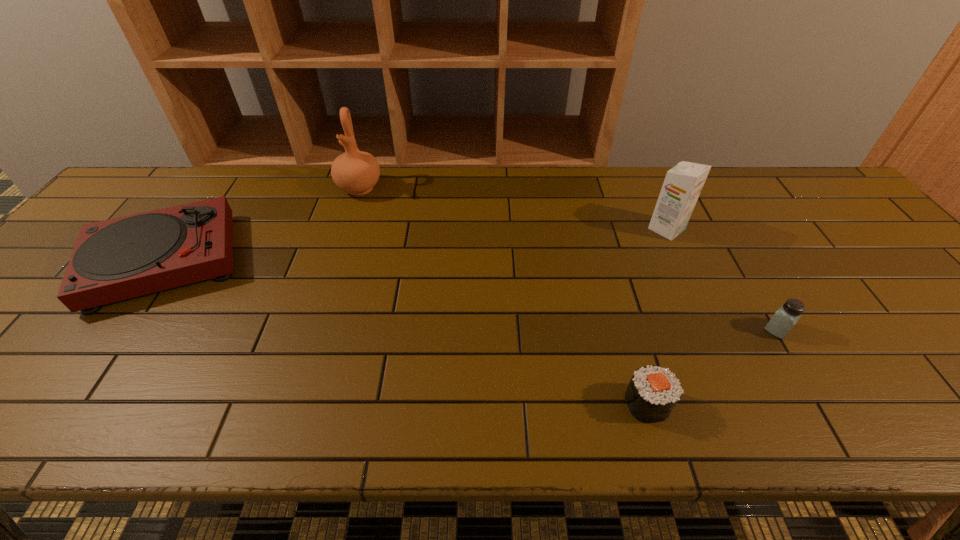
Find the location of a particular element. This screenshot has width=960, height=540. vacant space in between the carton and the nearest object is located at coordinates (657, 316).

At what (x,y) coordinates should I click in order to perform the action: click on free space between the third object from right to left and the pottery. Please return your answer as a coordinate pair (x, y). The width and height of the screenshot is (960, 540). Looking at the image, I should click on (503, 296).

The image size is (960, 540). I want to click on empty location between the sushi and the second tallest object, so click(x=657, y=316).

This screenshot has height=540, width=960. What are the coordinates of `the closest object to the farthest object` in the screenshot? It's located at (121, 258).

Identify which object is the fourth closest to the saltshaker. Please provide its 2D coordinates. Your answer should be formatted as a tuple, i.e. [(x, y)], where the tuple contains the x and y coordinates of a point satisfying the conditions above.

[(121, 258)]

Identify the location of vacant point that satisfies the following two spatial constraints: 1. on the back side of the leftmost object; 2. on the left side of the carton. Image resolution: width=960 pixels, height=540 pixels. (187, 229).

At what (x,y) coordinates should I click in order to perform the action: click on vacant space that satisfies the following two spatial constraints: 1. on the spout of the nearest object; 2. on the right side of the farthest object. Please return your answer as a coordinate pair (x, y). Looking at the image, I should click on (289, 404).

Locate an element on the screen. free location that satisfies the following two spatial constraints: 1. on the back side of the nearest object; 2. on the right side of the carton is located at coordinates (597, 229).